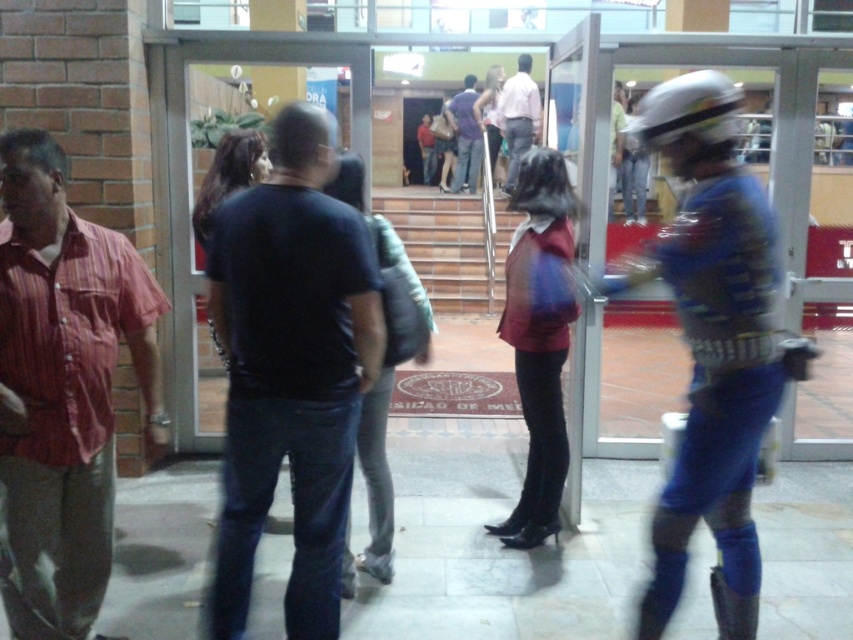
You are an event planner organizing a photoshoot in this public building. You need to position two models wearing the striped cotton shirt at left and the matte pink shirt at center. Since space is limited, you must ensure that the total width of both models does not exceed 1.5 meters. Given their individual widths, can both models stand side by side without exceeding the space?

The striped cotton shirt at left has a smaller width than the matte pink shirt at center. If their combined widths are under 1.5 meters, they can fit. However, without exact measurements, it is uncertain. The description only states the striped cotton shirt is narrower, but not by how much.

You are an event organizer arranging seats for a meeting. You need to seat two individuals wearing the dark blue shirt at center and the striped cotton shirt at left. Given their shirt sizes, which person requires a wider seat?

The dark blue shirt at center requires a wider seat because their shirt width is larger than the striped cotton shirt at left.